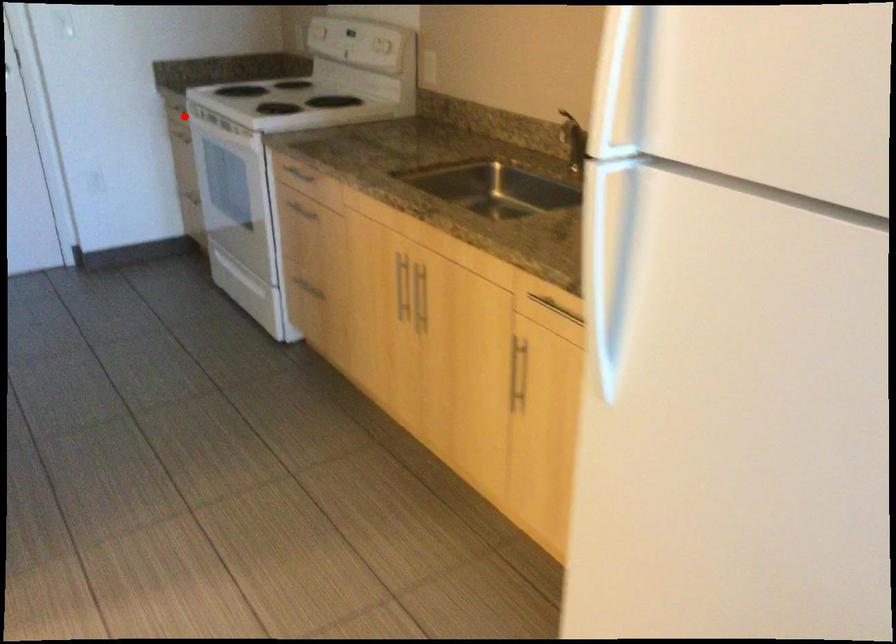
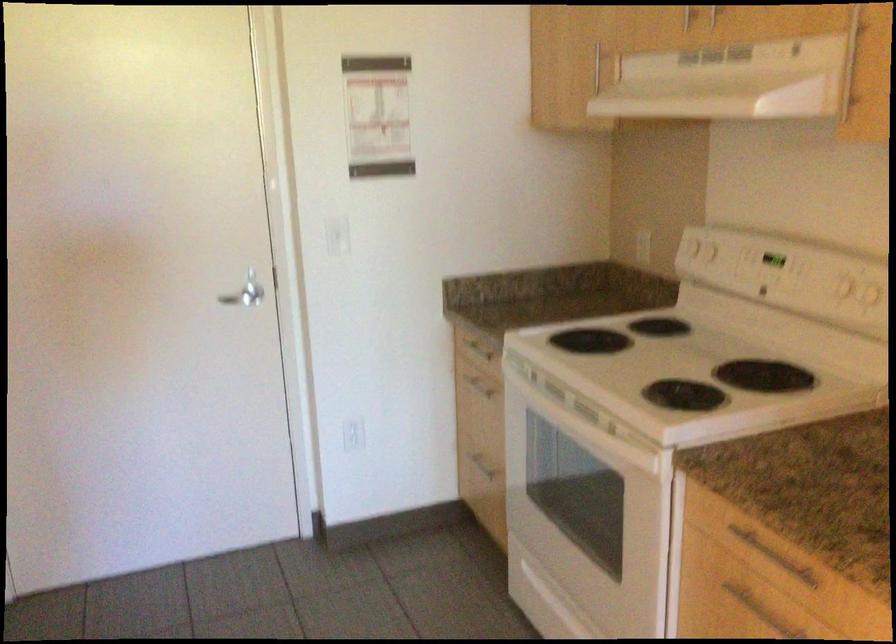
Locate, in the second image, the point that corresponds to the highlighted location in the first image.

(476, 346)